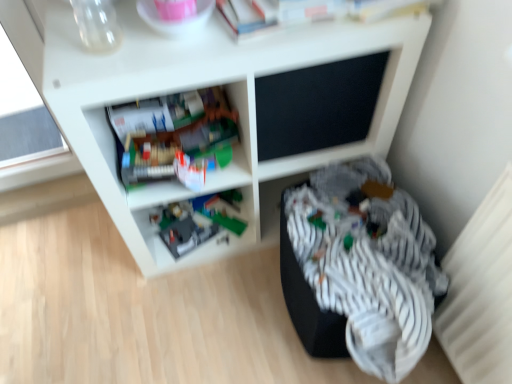
Find the location of `blank space situated above white matte shelf at center, which appears as the second shelf when viewed from the back (from a real-world perspective)`. blank space situated above white matte shelf at center, which appears as the second shelf when viewed from the back (from a real-world perspective) is located at coordinates (177, 34).